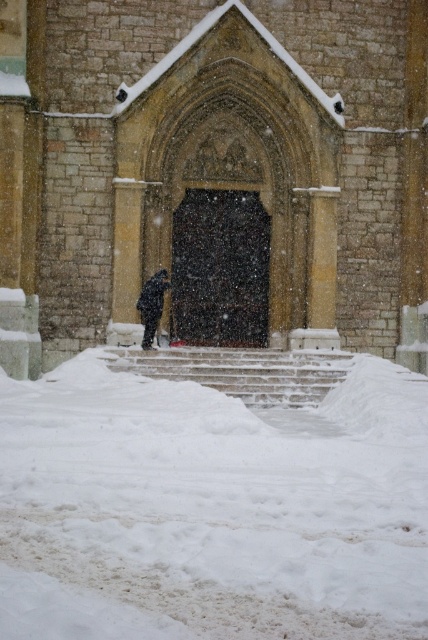
You are standing at the bottom of the steps leading to the brown stone church at center. You notice a person in a black matte coat at center walking up the steps. Which object in the scene is larger?

The brown stone church at center is bigger than the black matte coat at center, so the brown stone church at center is larger.

You are standing at the bottom of the steps leading to the brown stone church at center and the black matte coat at center. Which object is closer to your current position?

The black matte coat at center is closer to your current position because it is to the left of the brown stone church at center, which would be further up the steps.